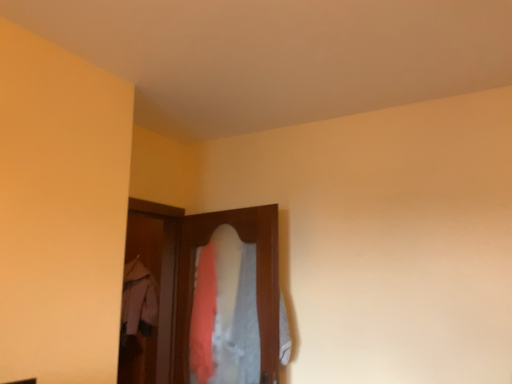
The width and height of the screenshot is (512, 384). What do you see at coordinates (138, 299) in the screenshot? I see `light pink fabric coat at center` at bounding box center [138, 299].

This screenshot has width=512, height=384. I want to click on textured fabric closet at center, so click(x=192, y=285).

This screenshot has width=512, height=384. In order to click on light pink fabric coat at center in this screenshot , I will do `click(138, 299)`.

Would you say light pink fabric coat at center is to the left or to the right of textured fabric closet at center in the picture?

In the image, light pink fabric coat at center appears on the left side of textured fabric closet at center.

Find the location of `closet on the right of the light pink fabric coat at center`. closet on the right of the light pink fabric coat at center is located at coordinates (192, 285).

Which of these two, light pink fabric coat at center or textured fabric closet at center, is bigger?

Bigger between the two is textured fabric closet at center.

Is light pink fabric coat at center taller than textured fabric closet at center?

No, light pink fabric coat at center is not taller than textured fabric closet at center.

From a real-world perspective, is wooden screen door at center positioned over light pink fabric coat at center based on gravity?

Yes, from a real-world perspective, wooden screen door at center is above light pink fabric coat at center.

Visually, is wooden screen door at center positioned to the left or to the right of light pink fabric coat at center?

wooden screen door at center is to the right of light pink fabric coat at center.

From the picture: How different are the orientations of wooden screen door at center and light pink fabric coat at center in degrees?

The angular difference between wooden screen door at center and light pink fabric coat at center is 90 degrees.

Is wooden screen door at center turned away from light pink fabric coat at center?

wooden screen door at center does not have its back to light pink fabric coat at center.

From the picture: From the image's perspective, which is below, textured fabric closet at center or wooden screen door at center?

From the image's view, wooden screen door at center is below.

From a real-world perspective, is textured fabric closet at center physically located above or below wooden screen door at center?

In terms of real-world spatial position, textured fabric closet at center is below wooden screen door at center.

Can we say textured fabric closet at center lies outside wooden screen door at center?

Yes, textured fabric closet at center is located beyond the bounds of wooden screen door at center.

Considering the points (154, 360) and (173, 210), which point is in front, point (154, 360) or point (173, 210)?

Positioned in front is point (173, 210).

Which of these two, wooden screen door at center or textured fabric closet at center, stands shorter?

textured fabric closet at center.

From a real-world perspective, is wooden screen door at center on top of textured fabric closet at center?

Yes, from a real-world perspective, wooden screen door at center is above textured fabric closet at center.

Which of these two, wooden screen door at center or textured fabric closet at center, is smaller?

wooden screen door at center.

Looking at their sizes, would you say wooden screen door at center is wider or thinner than textured fabric closet at center?

wooden screen door at center is wider than textured fabric closet at center.

Where is `screen door located in front of the light pink fabric coat at center`? The image size is (512, 384). screen door located in front of the light pink fabric coat at center is located at coordinates tap(154, 291).

Is wooden screen door at center surrounded by light pink fabric coat at center?

No, wooden screen door at center is located outside of light pink fabric coat at center.

From the picture: How different are the orientations of light pink fabric coat at center and wooden screen door at center in degrees?

The angular difference between light pink fabric coat at center and wooden screen door at center is 90 degrees.

From the image's perspective, which object appears higher, light pink fabric coat at center or wooden screen door at center?

From the image's view, wooden screen door at center is above.

Consider the image. Is textured fabric closet at center positioned with its back to light pink fabric coat at center?

No, textured fabric closet at center is not facing away from light pink fabric coat at center.

Does point (270, 319) appear closer or farther from the camera than point (148, 296)?

Point (270, 319).

Considering the positions of objects textured fabric closet at center and light pink fabric coat at center in the image provided, who is more to the left, textured fabric closet at center or light pink fabric coat at center?

Positioned to the left is light pink fabric coat at center.

Where is `closet that is in front of the light pink fabric coat at center`? closet that is in front of the light pink fabric coat at center is located at coordinates (192, 285).

Where is `screen door located above the light pink fabric coat at center (from a real-world perspective)`? The image size is (512, 384). screen door located above the light pink fabric coat at center (from a real-world perspective) is located at coordinates (154, 291).

Based on their spatial positions, is light pink fabric coat at center or wooden screen door at center further from textured fabric closet at center?

light pink fabric coat at center is further to textured fabric closet at center.

Looking at the image, which one is located closer to light pink fabric coat at center, wooden screen door at center or textured fabric closet at center?

Based on the image, wooden screen door at center appears to be nearer to light pink fabric coat at center.

Based on their spatial positions, is light pink fabric coat at center or textured fabric closet at center closer to wooden screen door at center?

Among the two, light pink fabric coat at center is located nearer to wooden screen door at center.

When comparing their distances from wooden screen door at center, does textured fabric closet at center or light pink fabric coat at center seem further?

textured fabric closet at center.

Which object lies nearer to the anchor point light pink fabric coat at center, textured fabric closet at center or wooden screen door at center?

wooden screen door at center is closer to light pink fabric coat at center.

Which object lies nearer to the anchor point textured fabric closet at center, wooden screen door at center or light pink fabric coat at center?

wooden screen door at center.

Locate an element on the screen. This screenshot has width=512, height=384. screen door located between textured fabric closet at center and light pink fabric coat at center in the depth direction is located at coordinates (154, 291).